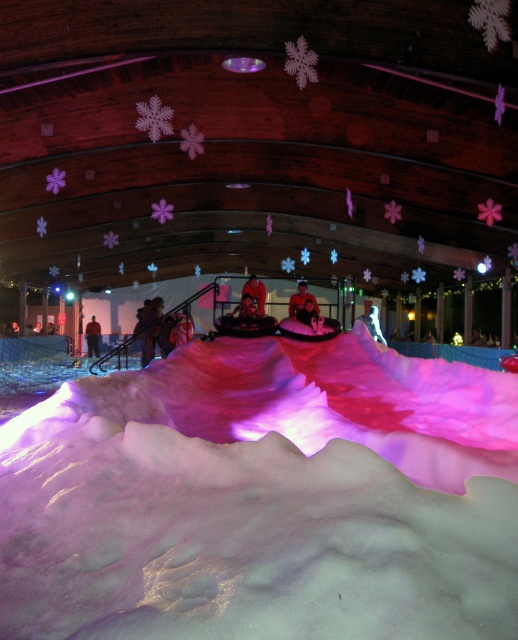
Question: Can you confirm if smooth pink snowboard at center is smaller than red fabric jacket at center?

Choices:
 (A) yes
 (B) no

Answer: (A)

Question: Estimate the real-world distances between objects in this image. Which object is farther from the white fluffy snow at center?

Choices:
 (A) red fabric jacket at center
 (B) red fabric jacket at lower left
 (C) smooth pink snowboard at center

Answer: (B)

Question: Which object is closer to the camera taking this photo?

Choices:
 (A) red fabric jacket at center
 (B) white fluffy snow at center
 (C) red fabric jacket at lower left
 (D) smooth pink snowboard at center

Answer: (B)

Question: Can you confirm if smooth pink snowboard at center is positioned above red fabric jacket at center?

Choices:
 (A) yes
 (B) no

Answer: (B)

Question: Does white fluffy snow at center appear on the right side of red fabric jacket at center?

Choices:
 (A) no
 (B) yes

Answer: (A)

Question: Which object appears closest to the camera in this image?

Choices:
 (A) red fabric jacket at center
 (B) white fluffy snow at center
 (C) smooth pink snowboard at center
 (D) red fabric jacket at lower left

Answer: (B)